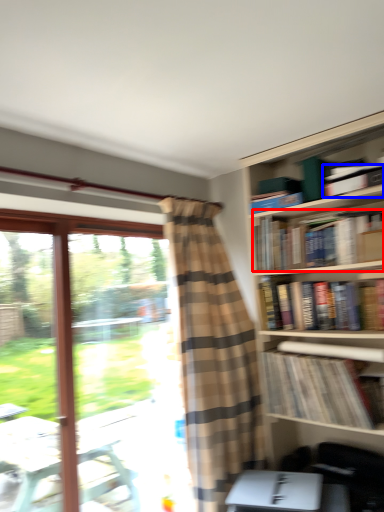
Question: Which point is further to the camera, book (highlighted by a red box) or book (highlighted by a blue box)?

Choices:
 (A) book
 (B) book

Answer: (B)